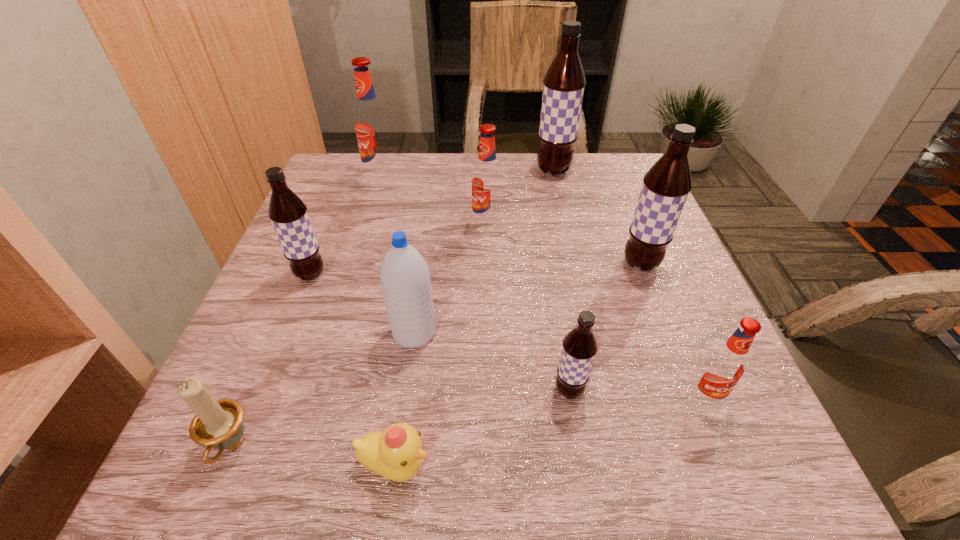
Where is `brown root beer that stands as the fourth closest to the water bottle`? brown root beer that stands as the fourth closest to the water bottle is located at coordinates (564, 82).

At what (x,y) coordinates should I click in order to perform the action: click on brown root beer that is the third closest to the leftmost brown root beer. Please return your answer as a coordinate pair (x, y). The height and width of the screenshot is (540, 960). Looking at the image, I should click on (666, 186).

Locate which red root beer is the closest to the eighth object from right to left. Please provide its 2D coordinates. Your answer should be formatted as a tuple, i.e. [(x, y)], where the tuple contains the x and y coordinates of a point satisfying the conditions above.

[(486, 179)]

Image resolution: width=960 pixels, height=540 pixels. I want to click on the second closest red root beer relative to the yellow duckling, so [x=486, y=179].